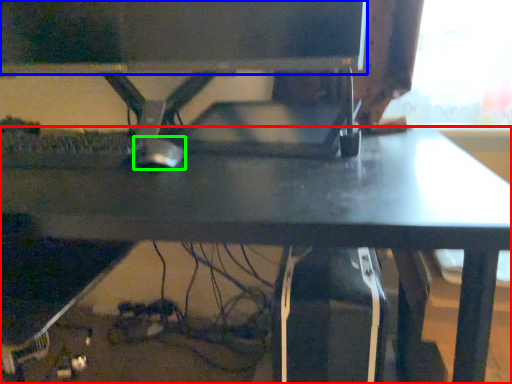
Question: Which object is the farthest from desk (highlighted by a red box)? Choose among these: computer monitor (highlighted by a blue box) or mouse (highlighted by a green box).

Choices:
 (A) computer monitor
 (B) mouse

Answer: (A)